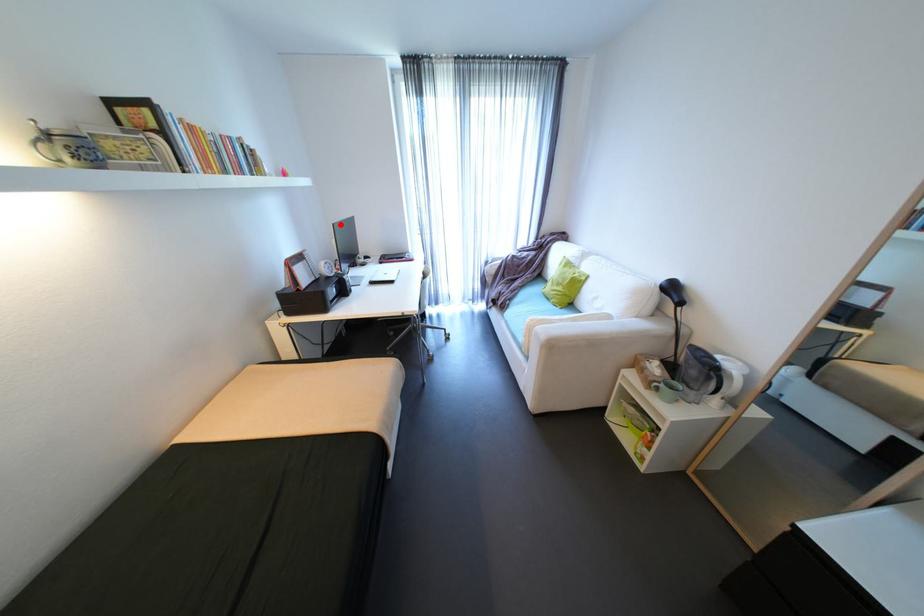
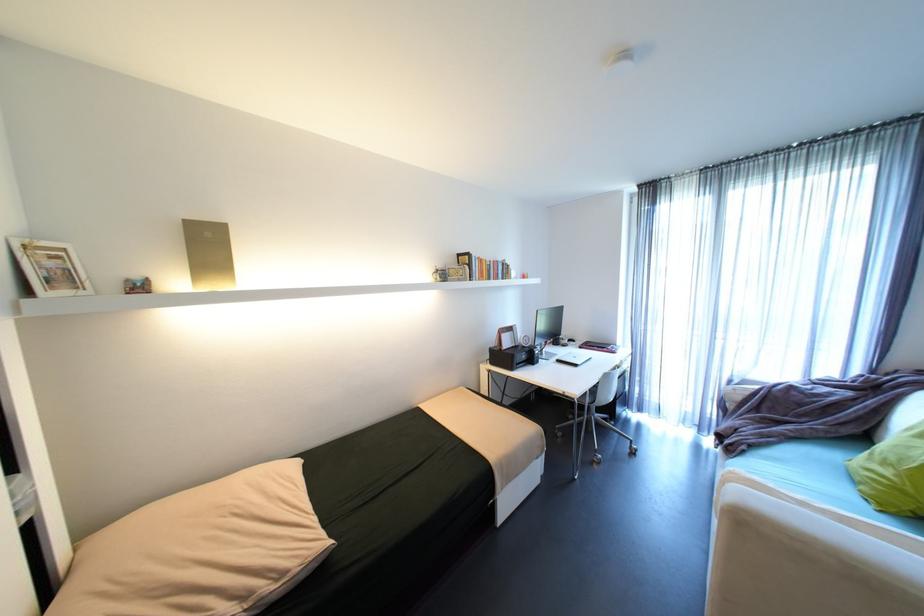
Question: A red point is marked in image1. In image2, is the corresponding 3D point closer to the camera or farther? Reply with the corresponding letter.

Choices:
 (A) The corresponding 3D point is closer.
 (B) The corresponding 3D point is farther.

Answer: (B)